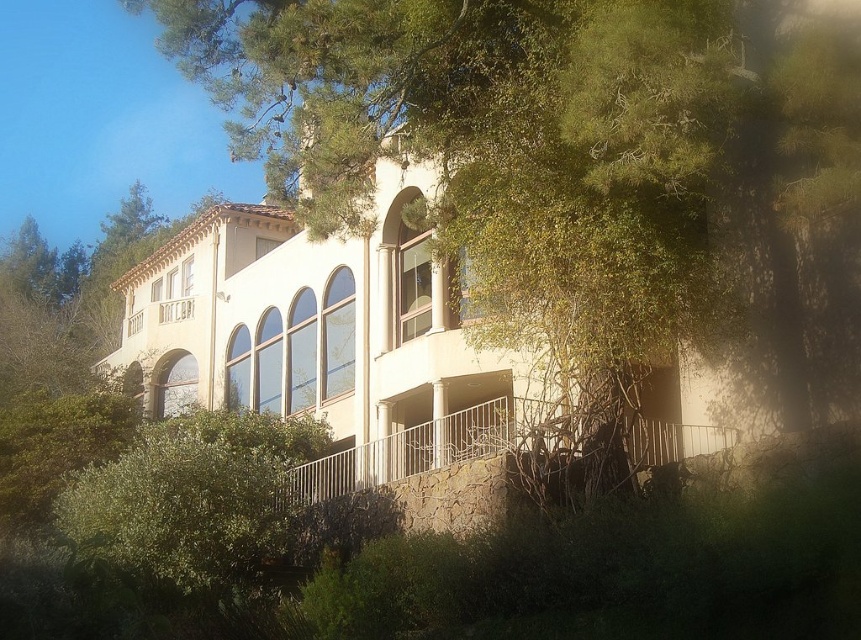
Between white stucco villa at center and white metal railing at lower center, which one is positioned lower?

Positioned lower is white metal railing at lower center.

Is point (403, 458) closer to camera compared to point (548, 432)?

No, it is behind (548, 432).

You are a GUI agent. You are given a task and a screenshot of the screen. Output one action in this format:
    pyautogui.click(x=<x>, y=<y>)
    Task: Click on the white stucco villa at center
    
    Given the screenshot: What is the action you would take?
    pyautogui.click(x=327, y=340)